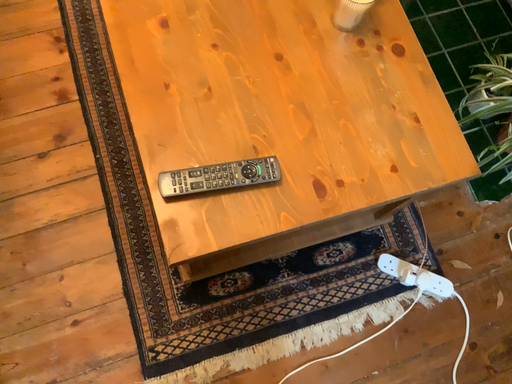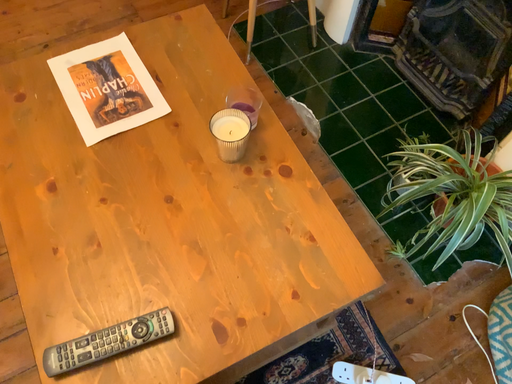
Question: Which way did the camera rotate in the video?

Choices:
 (A) rotated downward
 (B) rotated upward

Answer: (B)